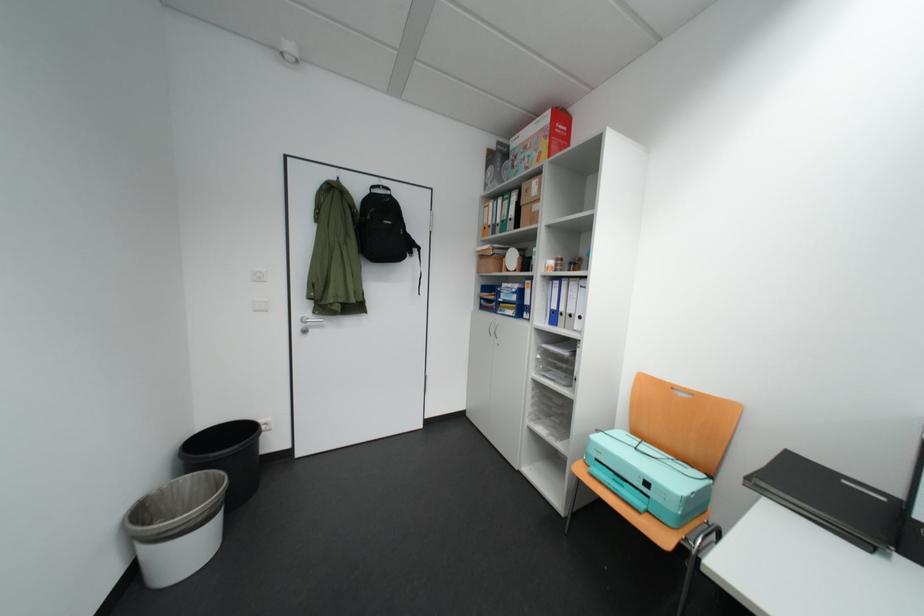
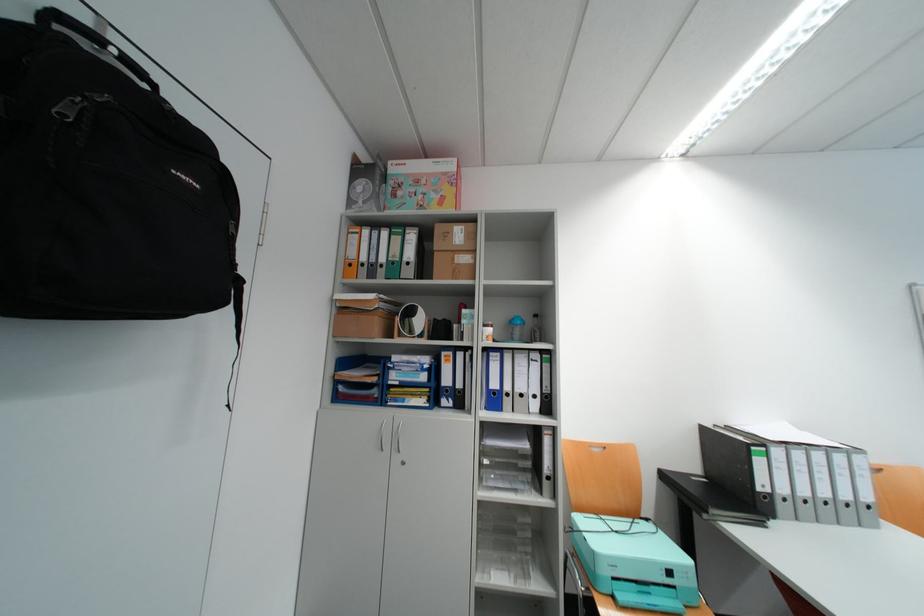
The point at (659, 485) is marked in the first image. Where is the corresponding point in the second image?

(682, 573)